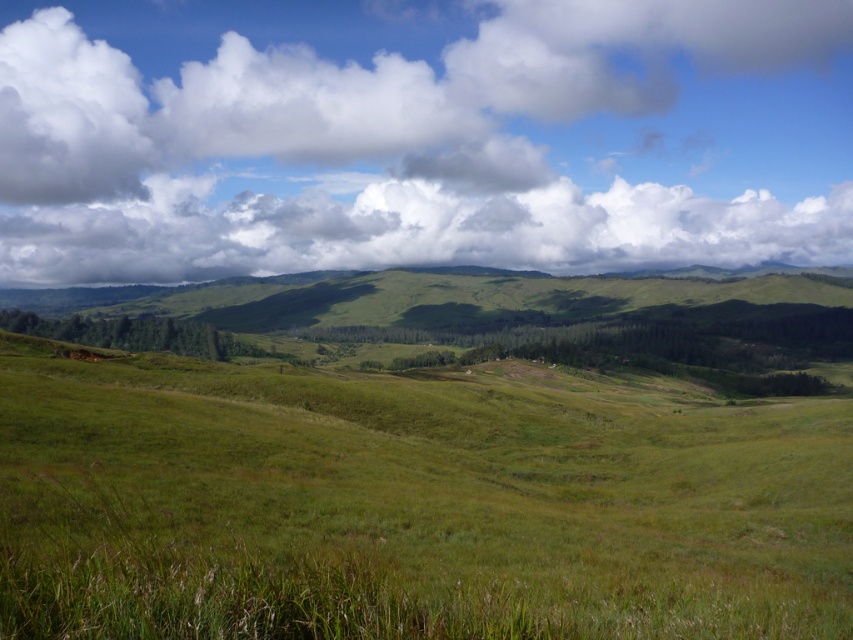
Does point (144, 584) come behind point (711, 188)?

No, it is not.

Is green grassy field at center further to the viewer compared to white fluffy cloud at upper center?

No, it is in front of white fluffy cloud at upper center.

Who is more forward, (677, 540) or (827, 70)?

Point (677, 540) is more forward.

The image size is (853, 640). What are the coordinates of `green grassy field at center` in the screenshot? It's located at (410, 502).